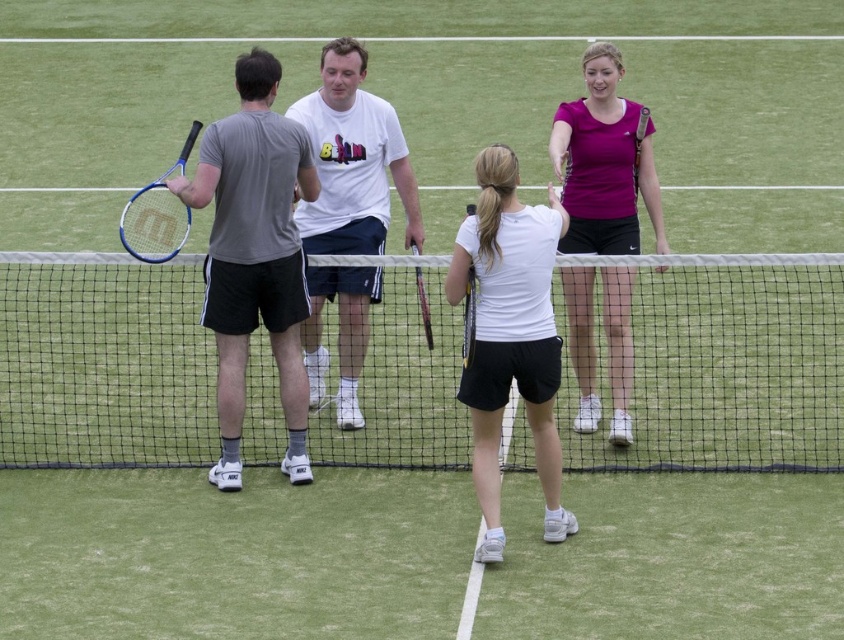
Is white mesh net at center bigger than white matte t-shirt at center?

Incorrect, white mesh net at center is not larger than white matte t-shirt at center.

Is white mesh net at center positioned in front of white matte t-shirt at center?

No.

Does point (675, 260) come in front of point (337, 280)?

Yes, it is.

Identify the location of white mesh net at center. (729, 369).

Does white mesh net at center lie behind wooden tennis racket at center?

That is True.

Between white mesh net at center and wooden tennis racket at center, which one appears on the left side from the viewer's perspective?

→ white mesh net at center

Is point (260, 352) positioned before point (471, 308)?

That is False.

This screenshot has height=640, width=844. In order to click on white mesh net at center in this screenshot , I will do `click(729, 369)`.

Can you confirm if gray matte t-shirt at left is thinner than purple matte tennis racket at upper right?

In fact, gray matte t-shirt at left might be wider than purple matte tennis racket at upper right.

Is point (279, 129) less distant than point (610, 240)?

Yes.

At what (x,y) coordinates should I click in order to perform the action: click on gray matte t-shirt at left. Please return your answer as a coordinate pair (x, y). Looking at the image, I should click on (253, 257).